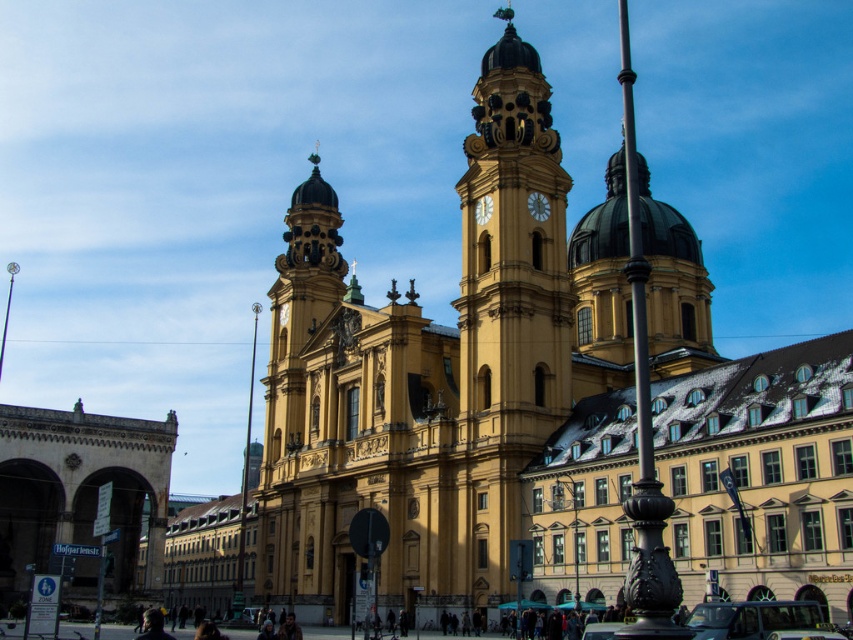
Can you confirm if yellow stone clock tower at center is taller than metallic gold clock at center?

Yes, yellow stone clock tower at center is taller than metallic gold clock at center.

Can you confirm if yellow stone clock tower at center is shorter than metallic gold clock at center?

No.

Between point (518, 353) and point (544, 218), which one is positioned behind?

Point (544, 218)

Locate an element on the screen. yellow stone clock tower at center is located at coordinates (506, 314).

Between point (527, 72) and point (479, 208), which one is positioned in front?

Point (479, 208) is in front.

This screenshot has width=853, height=640. Describe the element at coordinates (506, 314) in the screenshot. I see `yellow stone clock tower at center` at that location.

Describe the element at coordinates (506, 314) in the screenshot. This screenshot has height=640, width=853. I see `yellow stone clock tower at center` at that location.

Where is `yellow stone clock tower at center`? The height and width of the screenshot is (640, 853). yellow stone clock tower at center is located at coordinates (506, 314).

Who is positioned more to the right, metallic gold clock at center or yellow stone clock at center?

Result: Positioned to the right is metallic gold clock at center.

Measure the distance from metallic gold clock at center to yellow stone clock at center.

3.36 meters

Which is behind, point (548, 212) or point (476, 216)?

Positioned behind is point (476, 216).

Image resolution: width=853 pixels, height=640 pixels. Identify the location of metallic gold clock at center. (538, 205).